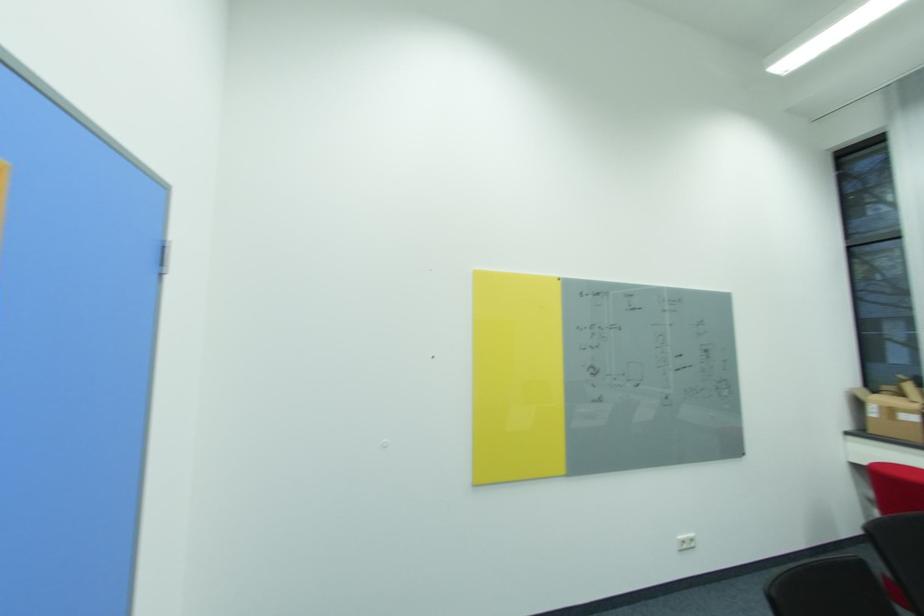
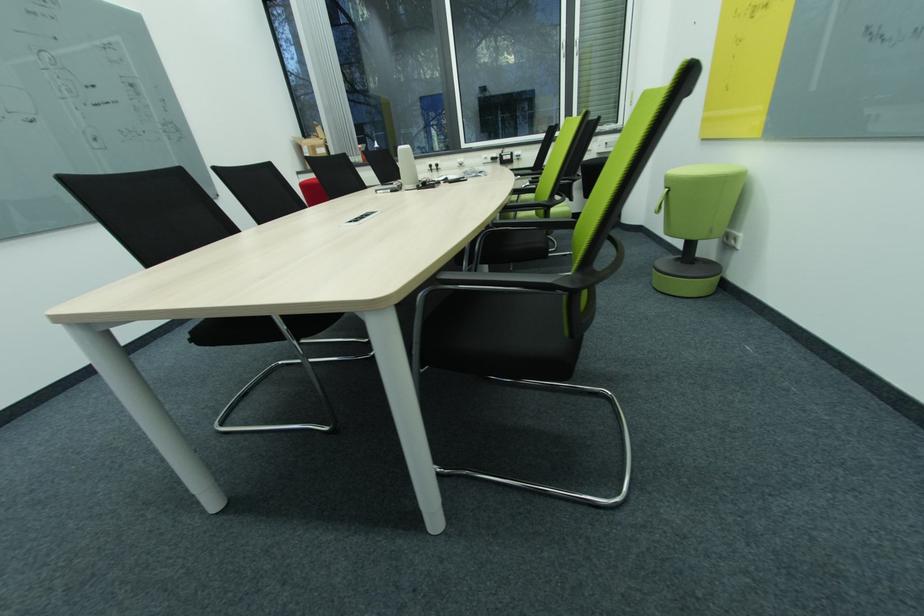
The images are taken continuously from a first-person perspective. In which direction is your viewpoint rotating?

The camera's rotation is toward right-down.